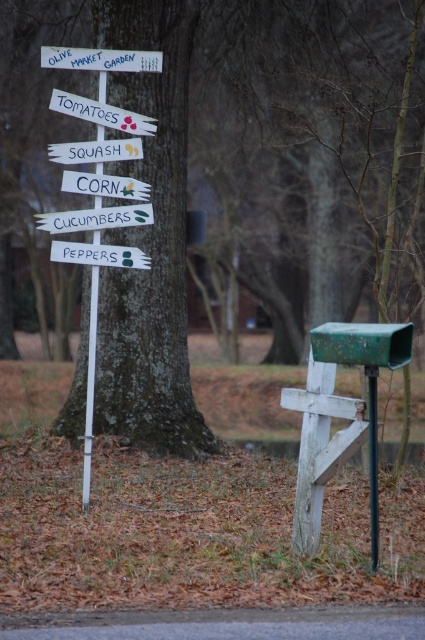
Question: Is green bark tree at center below white wood sign at center?

Choices:
 (A) yes
 (B) no

Answer: (B)

Question: Which point is closer to the camera taking this photo?

Choices:
 (A) (133, 253)
 (B) (88, 228)

Answer: (B)

Question: Which point appears farthest from the camera in this image?

Choices:
 (A) (201, 435)
 (B) (376, 541)
 (C) (127, 195)
 (D) (65, 113)

Answer: (A)

Question: Which point is closer to the camera?

Choices:
 (A) (95, 65)
 (B) (156, 81)
 (C) (371, 388)
 (D) (59, 248)

Answer: (C)

Question: Is white paper sign at upper center to the left of black plastic pole at center from the viewer's perspective?

Choices:
 (A) no
 (B) yes

Answer: (B)

Question: Is white wooden sign at upper center to the right of white wooden sign at center from the viewer's perspective?

Choices:
 (A) no
 (B) yes

Answer: (A)